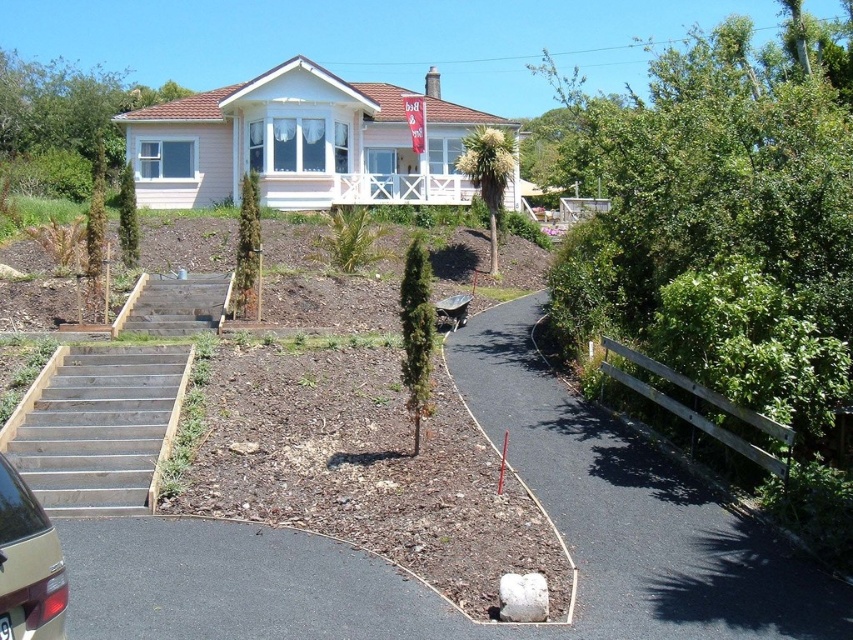
Question: Considering the relative positions of wooden stairs at lower left and metallic gold car at lower left in the image provided, where is wooden stairs at lower left located with respect to metallic gold car at lower left?

Choices:
 (A) above
 (B) below

Answer: (B)

Question: Is black asphalt driveway at center positioned behind wooden stairs at lower left?

Choices:
 (A) no
 (B) yes

Answer: (A)

Question: Which of the following is the farthest from the observer?

Choices:
 (A) (28, 570)
 (B) (140, 300)
 (C) (668, 608)

Answer: (B)

Question: Is black asphalt driveway at center to the left of brown wooden stairs at lower left from the viewer's perspective?

Choices:
 (A) yes
 (B) no

Answer: (B)

Question: Which point is farther to the camera?

Choices:
 (A) pyautogui.click(x=698, y=584)
 (B) pyautogui.click(x=97, y=376)
 (C) pyautogui.click(x=53, y=529)

Answer: (B)

Question: Which object is closer to the camera taking this photo?

Choices:
 (A) metallic gold car at lower left
 (B) brown wooden stairs at lower left
 (C) black asphalt driveway at center
 (D) wooden stairs at lower left

Answer: (A)